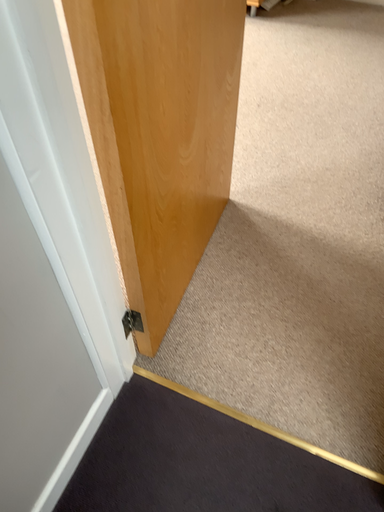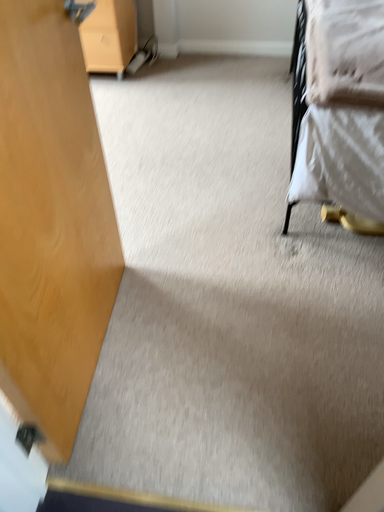
Question: Which way did the camera rotate in the video?

Choices:
 (A) rotated left
 (B) rotated right

Answer: (B)